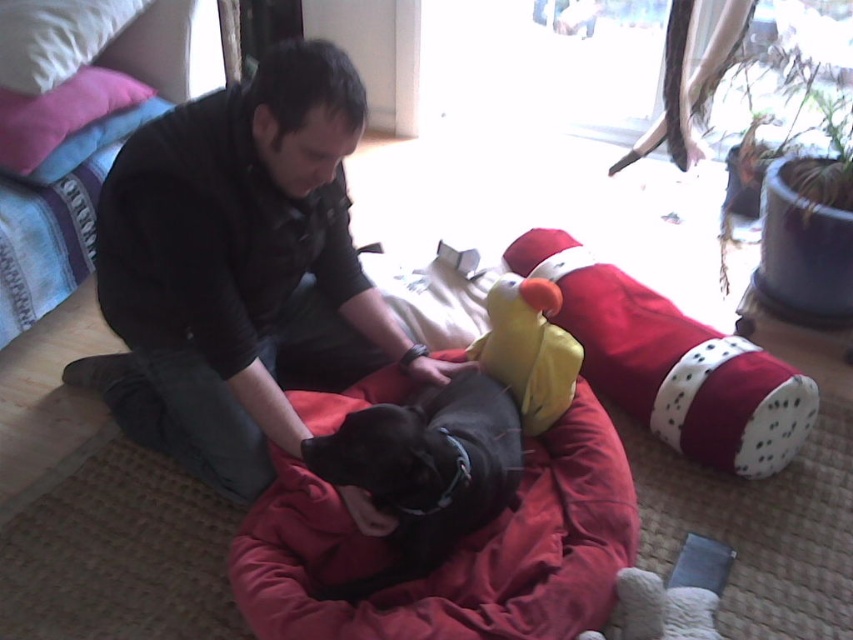
You are a person who wants to sit on the red fabric bean bag at lower center. From your current position, where is the velvet pink pillow at upper left located relative to the bean bag?

The velvet pink pillow at upper left is behind the red fabric bean bag at lower center.

You are a pet sitter who needs to place a new blanket over the black smooth dog at center and the white soft pillow at upper left. Which object requires a larger blanket to cover completely?

The black smooth dog at center requires a larger blanket because it is much taller than the white soft pillow at upper left.